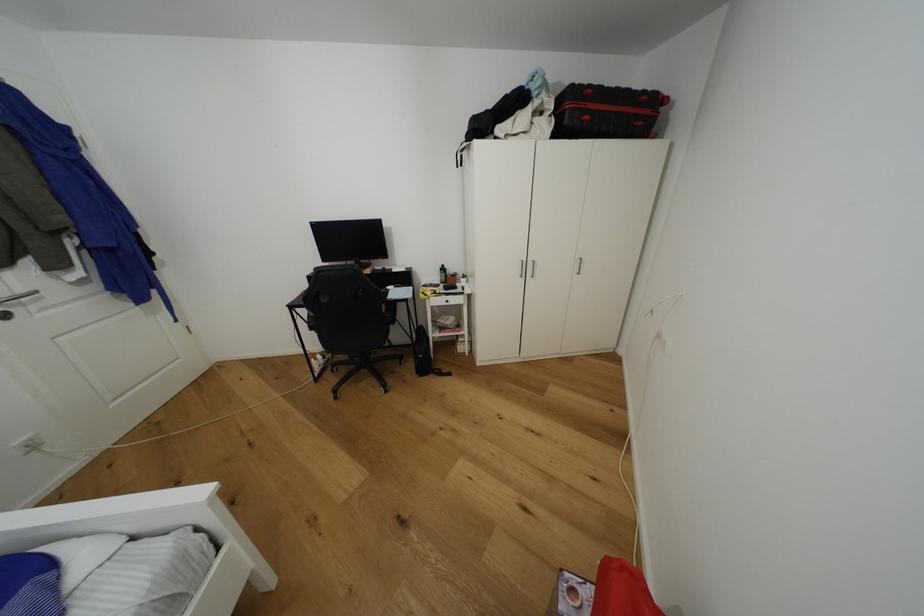
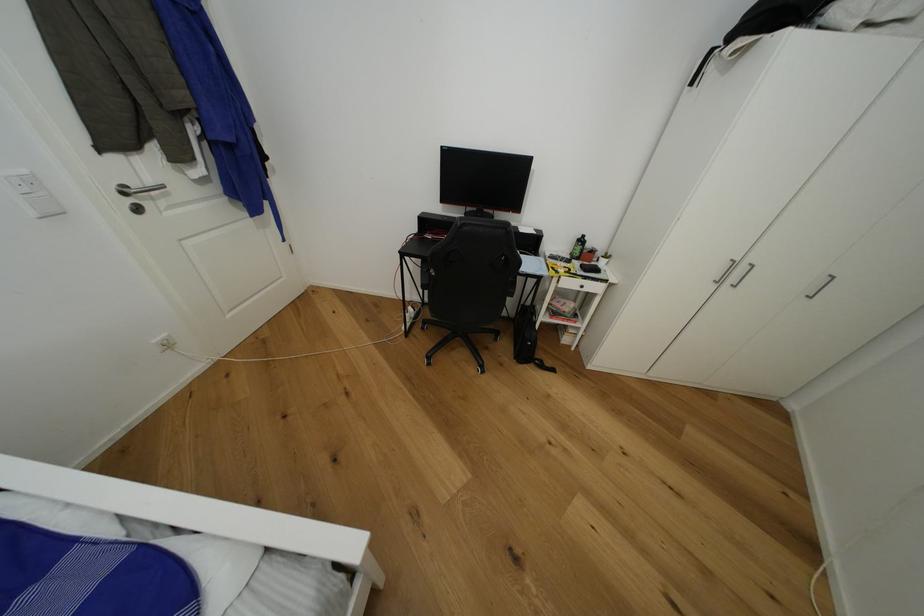
Question: The images are taken continuously from a first-person perspective. In which direction is your viewpoint rotating?

Choices:
 (A) Left
 (B) Right
 (C) Up
 (D) Down

Answer: (D)